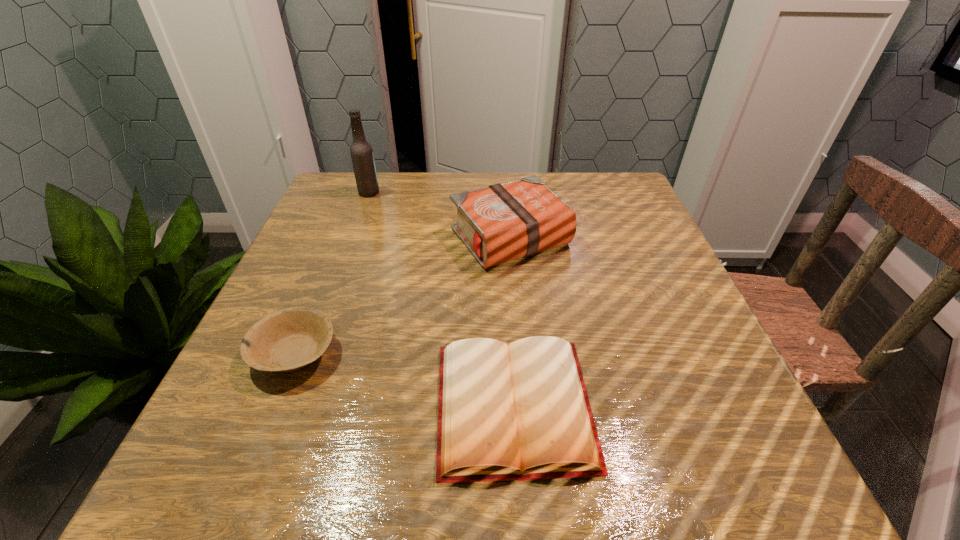
Locate an element on the screen. free space between the beer bottle and the farther Bible is located at coordinates (440, 215).

This screenshot has height=540, width=960. Identify the location of free spot between the shortest object and the farthest object. (442, 299).

Where is `empty space that is in between the nearer Bible and the tallest object`? The height and width of the screenshot is (540, 960). empty space that is in between the nearer Bible and the tallest object is located at coordinates (442, 299).

What are the coordinates of `object that is the third closest one to the third tallest object` in the screenshot? It's located at (361, 151).

Select which object appears as the closest to the beer bottle. Please provide its 2D coordinates. Your answer should be formatted as a tuple, i.e. [(x, y)], where the tuple contains the x and y coordinates of a point satisfying the conditions above.

[(503, 222)]

Locate an element on the screen. Image resolution: width=960 pixels, height=540 pixels. vacant space that satisfies the following two spatial constraints: 1. on the side of the tallest object with the label; 2. on the right side of the taller Bible is located at coordinates (352, 238).

The width and height of the screenshot is (960, 540). What are the coordinates of `vacant space that satisfies the following two spatial constraints: 1. on the side of the farther Bible with the label; 2. on the right side of the tallest object` in the screenshot? It's located at (352, 238).

Find the location of a particular element. vacant space that satisfies the following two spatial constraints: 1. on the back side of the shorter Bible; 2. on the side of the beer bottle with the label is located at coordinates (500, 192).

At what (x,y) coordinates should I click in order to perform the action: click on vacant point that satisfies the following two spatial constraints: 1. on the side of the tallest object with the label; 2. on the back side of the taller Bible. Please return your answer as a coordinate pair (x, y). This screenshot has height=540, width=960. Looking at the image, I should click on (352, 238).

Where is `vacant position in the image that satisfies the following two spatial constraints: 1. on the back side of the shorter Bible; 2. on the left side of the third shortest object`? vacant position in the image that satisfies the following two spatial constraints: 1. on the back side of the shorter Bible; 2. on the left side of the third shortest object is located at coordinates (503, 238).